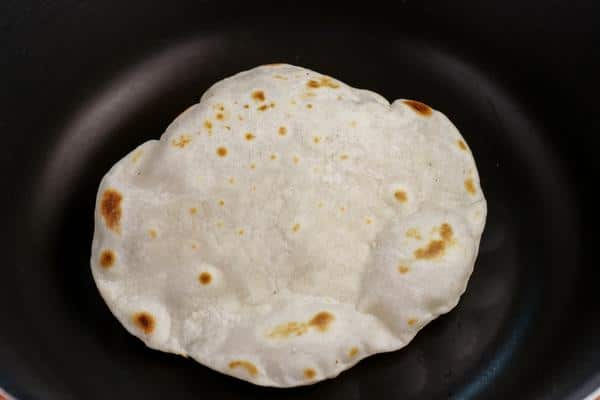
What are the coordinates of `black frying pan` in the screenshot? It's located at (446, 351).